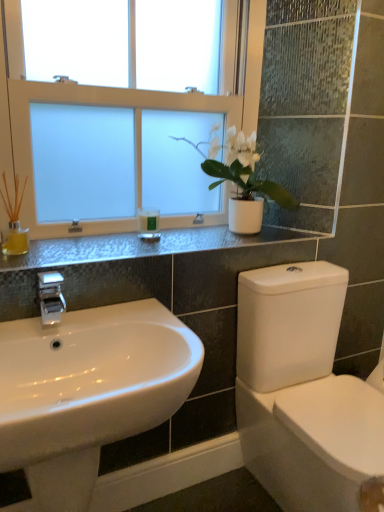
You are a GUI agent. You are given a task and a screenshot of the screen. Output one action in this format:
    pyautogui.click(x=<x>, y=<y>)
    Task: Click on the free spot in front of green matte candle at center
    The image size is (384, 512).
    Given the screenshot: What is the action you would take?
    pyautogui.click(x=144, y=248)